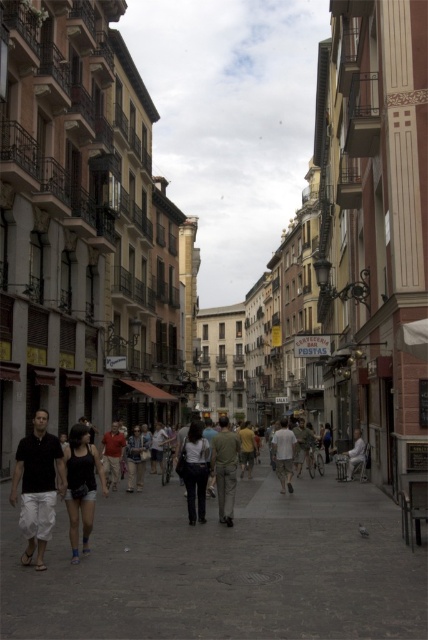
Question: Estimate the real-world distances between objects in this image. Which object is farther from the khaki pants at center?

Choices:
 (A) gray concrete pavement at center
 (B) matte black tank top at center

Answer: (B)

Question: Considering the relative positions of matte black tank top at center and light beige pants at center in the image provided, where is matte black tank top at center located with respect to light beige pants at center?

Choices:
 (A) below
 (B) above

Answer: (B)

Question: Is matte black tank top at center wider than khaki cotton pants at center?

Choices:
 (A) no
 (B) yes

Answer: (B)

Question: Based on their relative distances, which object is nearer to the matte black tank top at center?

Choices:
 (A) khaki cotton pants at center
 (B) khaki pants at center

Answer: (B)

Question: Is gray concrete pavement at center below light beige pants at center?

Choices:
 (A) yes
 (B) no

Answer: (A)

Question: Which object is closer to the camera taking this photo?

Choices:
 (A) dark gray pants at center
 (B) matte black tank top at center
 (C) matte black shirt at center

Answer: (C)